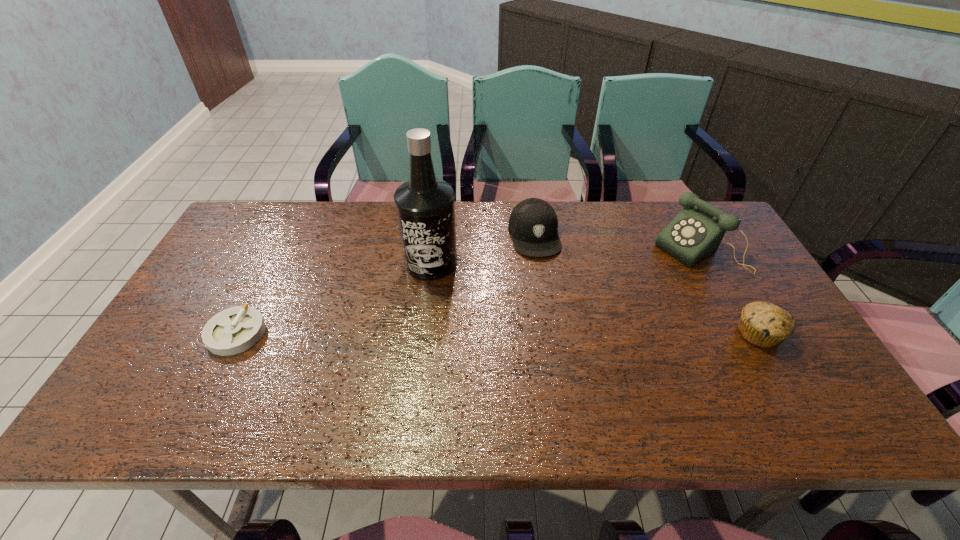
Find the location of `free space on the desktop that is between the ashtray and the muffin and is positioned on the front-facing side of the third object from left to right`. free space on the desktop that is between the ashtray and the muffin and is positioned on the front-facing side of the third object from left to right is located at coordinates (559, 334).

The image size is (960, 540). What are the coordinates of `free space on the desktop that is between the shortest object and the muffin and is positioned on the front label of the liquor` in the screenshot? It's located at (430, 333).

Identify the location of free space on the desktop that is between the leftmost object and the muffin and is positioned on the dial of the fourth shortest object. This screenshot has height=540, width=960. (557, 334).